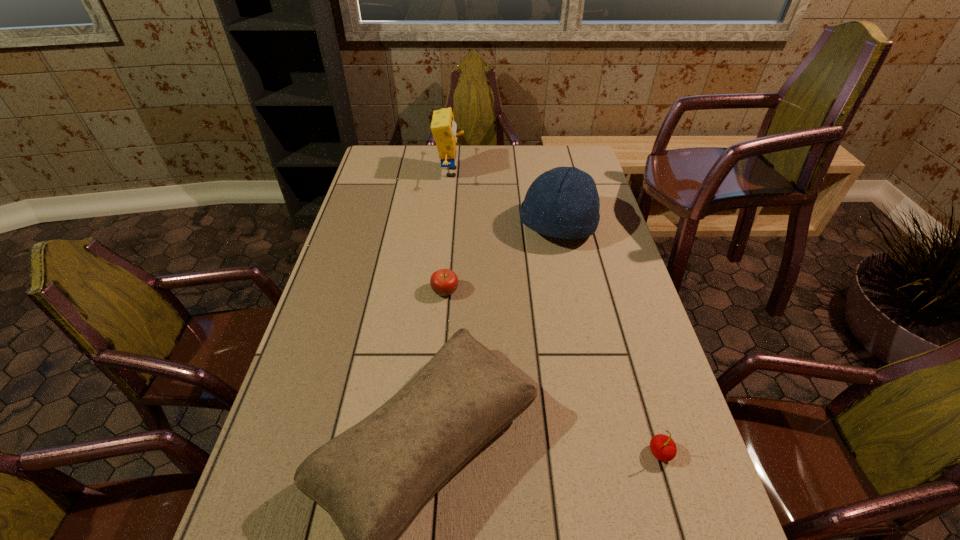
The width and height of the screenshot is (960, 540). What are the coordinates of `vacant area that lies between the shortest object and the cherry` in the screenshot? It's located at (553, 372).

Locate an element on the screen. The width and height of the screenshot is (960, 540). free space between the shortest object and the farthest object is located at coordinates (447, 232).

You are a GUI agent. You are given a task and a screenshot of the screen. Output one action in this format:
    pyautogui.click(x=<x>, y=<y>)
    Task: Click on the vacant area between the cherry and the sponge
    This screenshot has height=540, width=960.
    Given the screenshot: What is the action you would take?
    (x=555, y=313)

The image size is (960, 540). I want to click on free spot between the third nearest object and the second farthest object, so click(501, 259).

I want to click on free space between the third farthest object and the farthest object, so click(x=447, y=232).

Where is `free point between the third farthest object and the farthest object`? Image resolution: width=960 pixels, height=540 pixels. free point between the third farthest object and the farthest object is located at coordinates (447, 232).

Identify which object is the third nearest to the fourth shortest object. Please provide its 2D coordinates. Your answer should be formatted as a tuple, i.e. [(x, y)], where the tuple contains the x and y coordinates of a point satisfying the conditions above.

[(373, 479)]

Locate which object is the second closest to the third shortest object. Please provide its 2D coordinates. Your answer should be formatted as a tuple, i.e. [(x, y)], where the tuple contains the x and y coordinates of a point satisfying the conditions above.

[(663, 447)]

The width and height of the screenshot is (960, 540). I want to click on vacant space that satisfies the following two spatial constraints: 1. on the face of the cherry; 2. on the right side of the farthest object, so click(x=424, y=453).

The height and width of the screenshot is (540, 960). I want to click on free space that satisfies the following two spatial constraints: 1. on the face of the apple; 2. on the left side of the farthest object, so click(x=440, y=291).